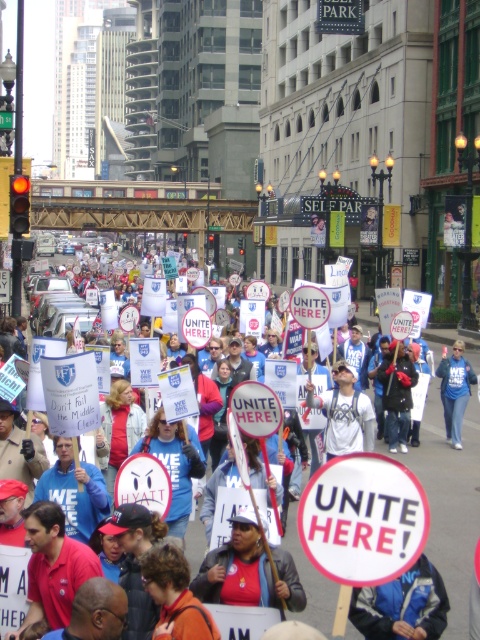
You are a photographer at the protest scene. You want to capture a photo that includes both the white paper sign at center and the blue fabric sign at center. Which sign will appear larger in the photo?

The white paper sign at center has a larger size compared to the blue fabric sign at center, so it will appear larger in the photo.

You are a photographer at the protest and want to capture both the white paper sign at center and the blue fabric sign at center in a single shot. Which sign should you focus on first to ensure both are in frame?

The white paper sign at center is positioned under the blue fabric sign at center, so focusing on the blue fabric sign at center first would allow the photographer to include both signs in the frame since the white one is beneath it.

You are a photographer trying to capture the protest scene. You notice two signs at the center of the image, the white paper sign at center and the blue fabric sign at center. Which sign is wider?

The white paper sign at center is wider than the blue fabric sign at center according to the description.